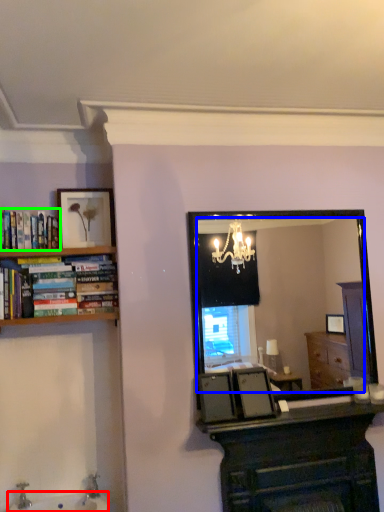
Question: Which object is the farthest from sink (highlighted by a red box)? Choose among these: mirror (highlighted by a blue box) or book (highlighted by a green box).

Choices:
 (A) mirror
 (B) book

Answer: (A)